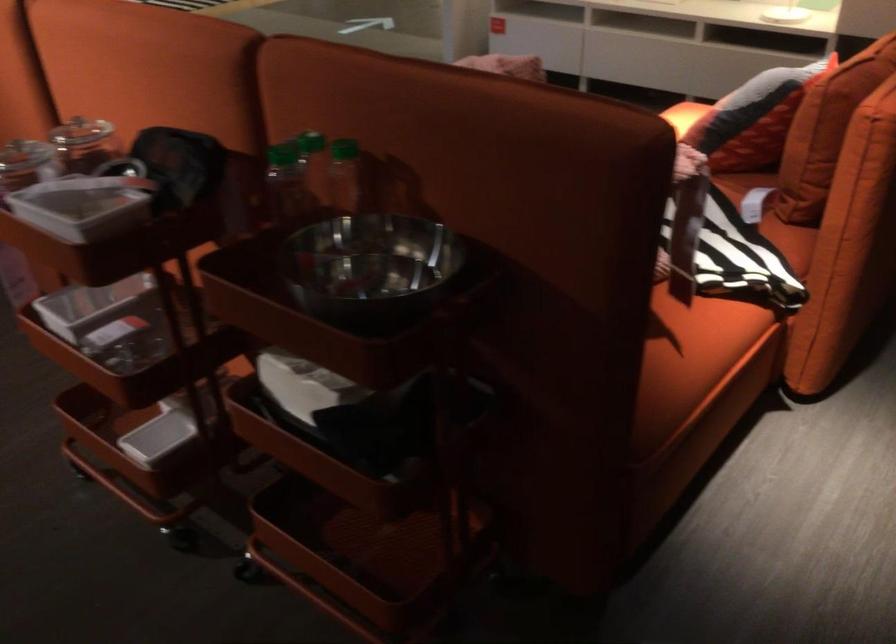
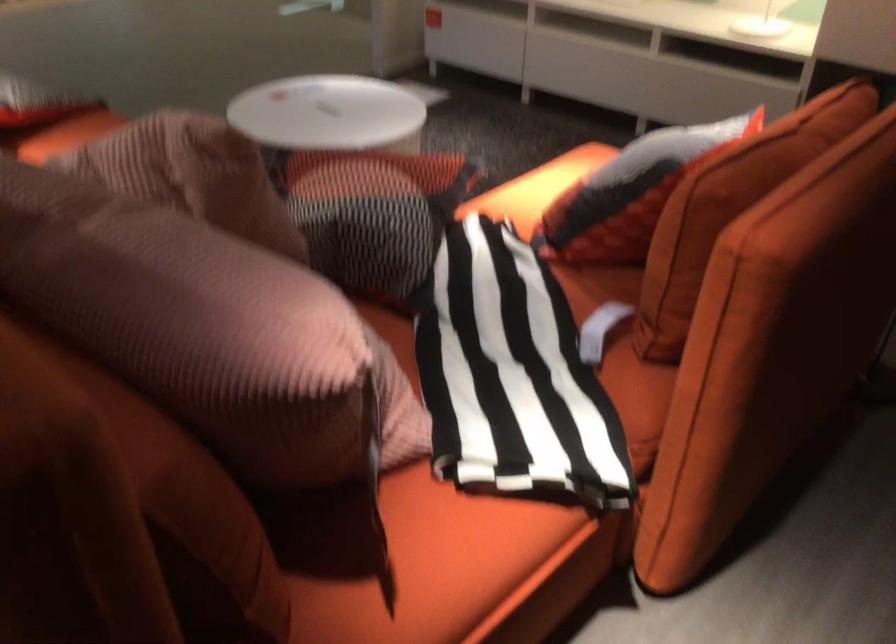
Where in the second image is the point corresponding to point 698,328 from the first image?

(434, 565)